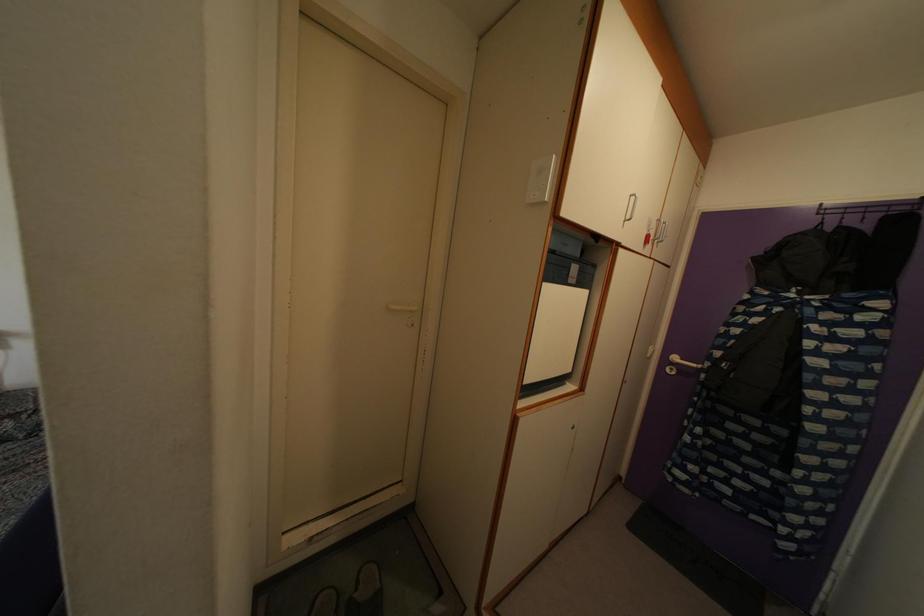
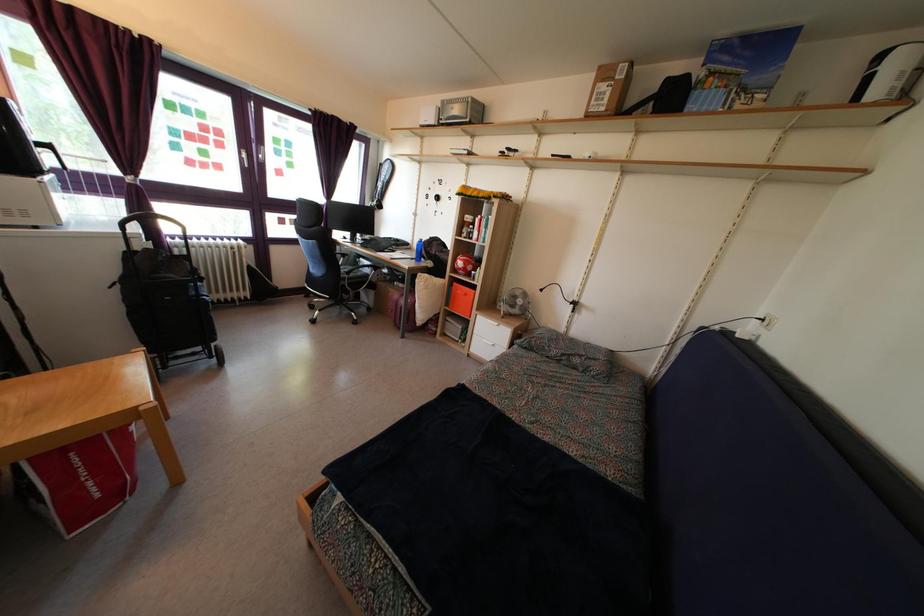
Question: The camera is either moving clockwise (left) or counter-clockwise (right) around the object. The first image is from the beginning of the video and the second image is from the end. Is the camera moving left or right when shooting the video?

Choices:
 (A) Left
 (B) Right

Answer: (B)